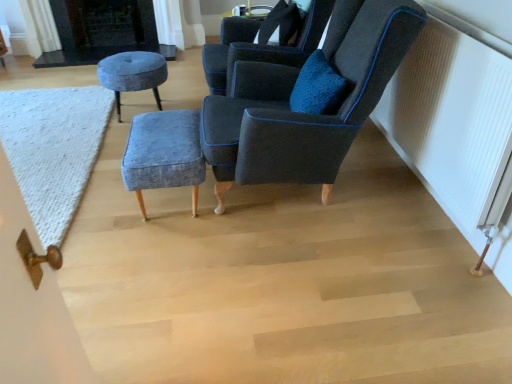
Identify the location of vacant area that lies between denim fabric stool at center, the 2th stool when ordered from back to front, and white textured radiator at right. (320, 221).